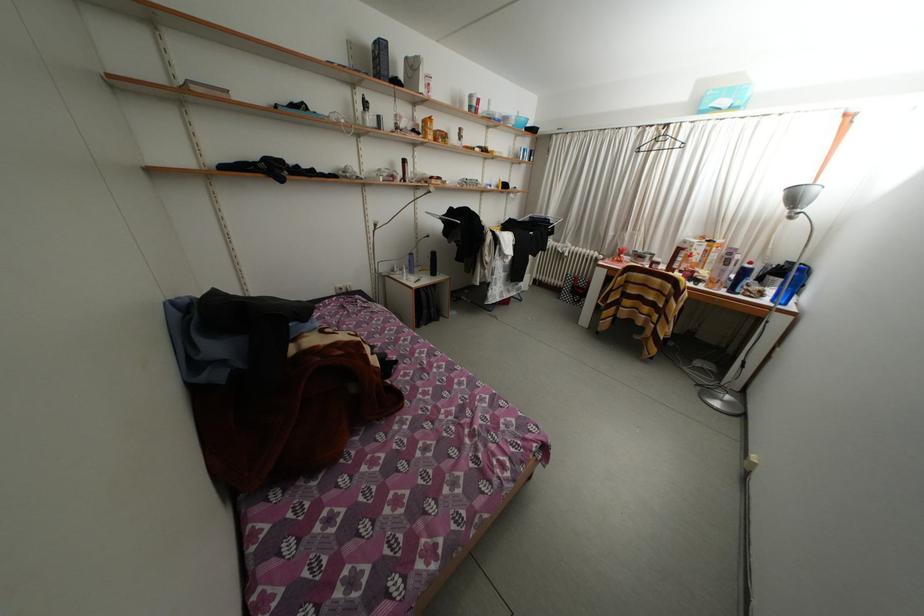
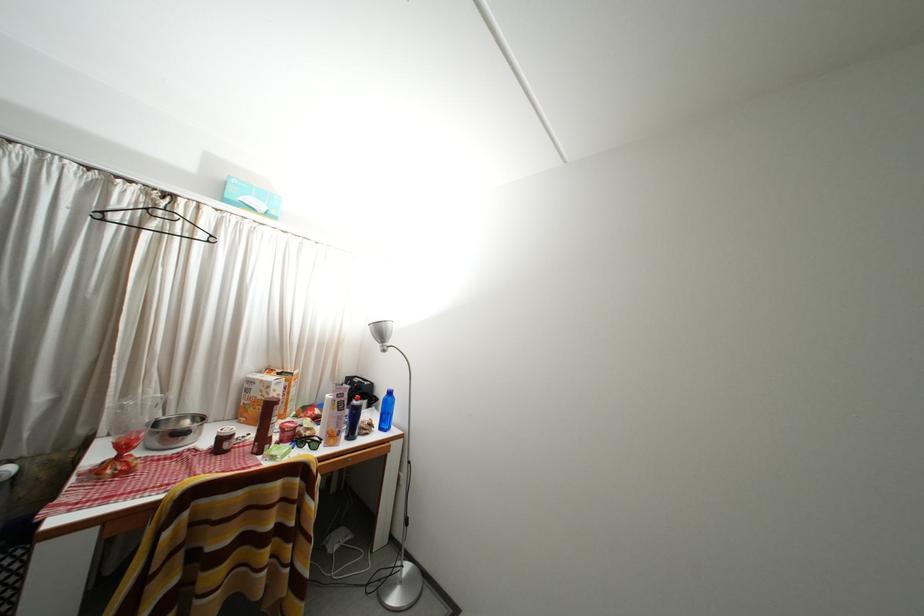
In the second image, find the point that corresponds to point (735, 108) in the first image.

(268, 211)